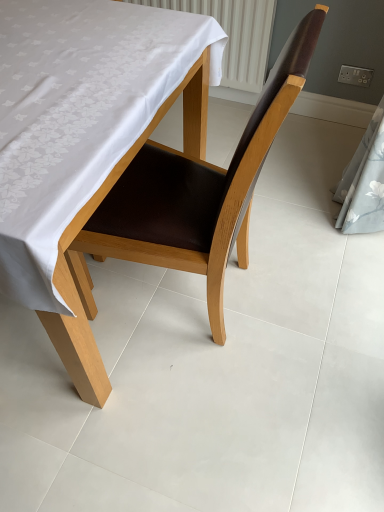
Question: Is brown leather chair at center facing towards white fabric-covered table at center?

Choices:
 (A) no
 (B) yes

Answer: (B)

Question: Is brown leather chair at center shorter than white fabric-covered table at center?

Choices:
 (A) yes
 (B) no

Answer: (B)

Question: Is white fabric-covered table at center surrounded by brown leather chair at center?

Choices:
 (A) no
 (B) yes

Answer: (A)

Question: Considering the relative positions of brown leather chair at center and white fabric-covered table at center in the image provided, is brown leather chair at center to the right of white fabric-covered table at center from the viewer's perspective?

Choices:
 (A) yes
 (B) no

Answer: (A)

Question: Does brown leather chair at center have a greater height compared to white fabric-covered table at center?

Choices:
 (A) yes
 (B) no

Answer: (A)

Question: Is the depth of brown leather chair at center greater than that of white fabric-covered table at center?

Choices:
 (A) yes
 (B) no

Answer: (A)

Question: Does white fabric-covered table at center have a lesser height compared to brown leather chair at center?

Choices:
 (A) no
 (B) yes

Answer: (B)

Question: From a real-world perspective, is white fabric-covered table at center below brown leather chair at center?

Choices:
 (A) yes
 (B) no

Answer: (A)

Question: From the image's perspective, is white fabric-covered table at center located above brown leather chair at center?

Choices:
 (A) yes
 (B) no

Answer: (A)

Question: Is white fabric-covered table at center oriented away from brown leather chair at center?

Choices:
 (A) no
 (B) yes

Answer: (A)

Question: Does white fabric-covered table at center contain brown leather chair at center?

Choices:
 (A) yes
 (B) no

Answer: (A)

Question: Is the depth of white fabric-covered table at center greater than that of brown leather chair at center?

Choices:
 (A) no
 (B) yes

Answer: (A)

Question: Considering the relative positions of white fabric-covered table at center and brown leather chair at center in the image provided, is white fabric-covered table at center to the left or to the right of brown leather chair at center?

Choices:
 (A) right
 (B) left

Answer: (B)